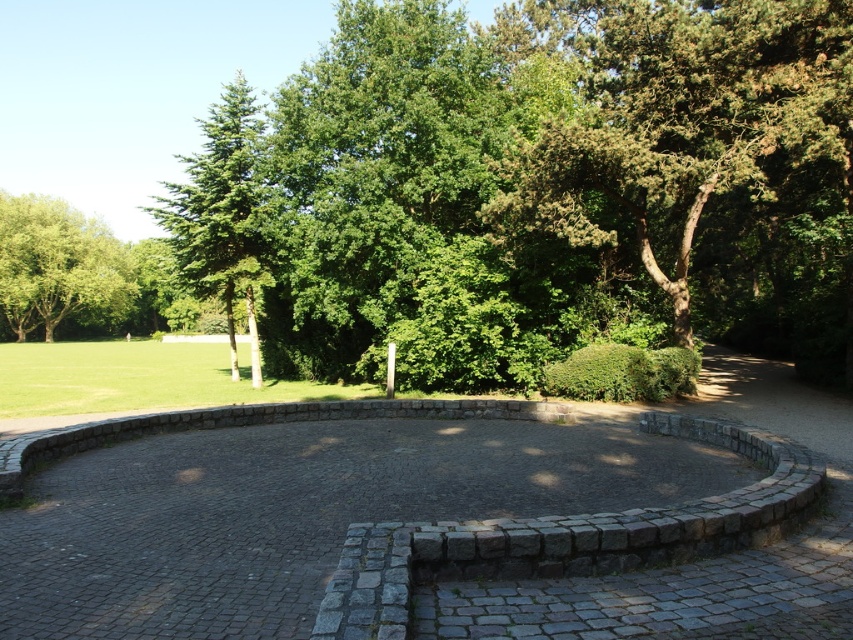
Question: Which is nearer to the green leafy bush at center?

Choices:
 (A) green leafy tree at left
 (B) green leafy tree at upper left

Answer: (B)

Question: Considering the real-world distances, which object is closest to the green leafy bush at center?

Choices:
 (A) green textured tree at upper right
 (B) green leafy tree at left
 (C) green leafy tree at upper left

Answer: (A)

Question: Is green textured tree at upper right above green leafy tree at upper left?

Choices:
 (A) no
 (B) yes

Answer: (A)

Question: Does green textured tree at upper right have a larger size compared to green leafy bush at center?

Choices:
 (A) yes
 (B) no

Answer: (A)

Question: Does green textured tree at upper right appear under green leafy tree at upper left?

Choices:
 (A) yes
 (B) no

Answer: (A)

Question: Which object appears closest to the camera in this image?

Choices:
 (A) green leafy bush at center
 (B) green leafy tree at left
 (C) green leafy tree at upper left

Answer: (A)